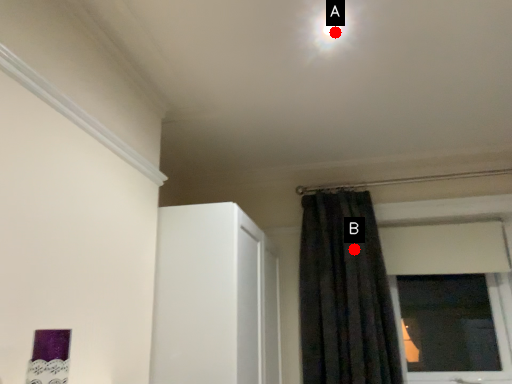
Question: Two points are circled on the image, labeled by A and B beside each circle. Which point is closer to the camera?

Choices:
 (A) A is closer
 (B) B is closer

Answer: (A)